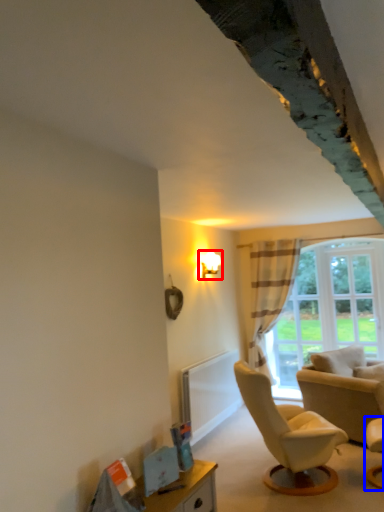
Question: Which object is further to the camera taking this photo, light fixture (highlighted by a red box) or chair (highlighted by a blue box)?

Choices:
 (A) light fixture
 (B) chair

Answer: (A)